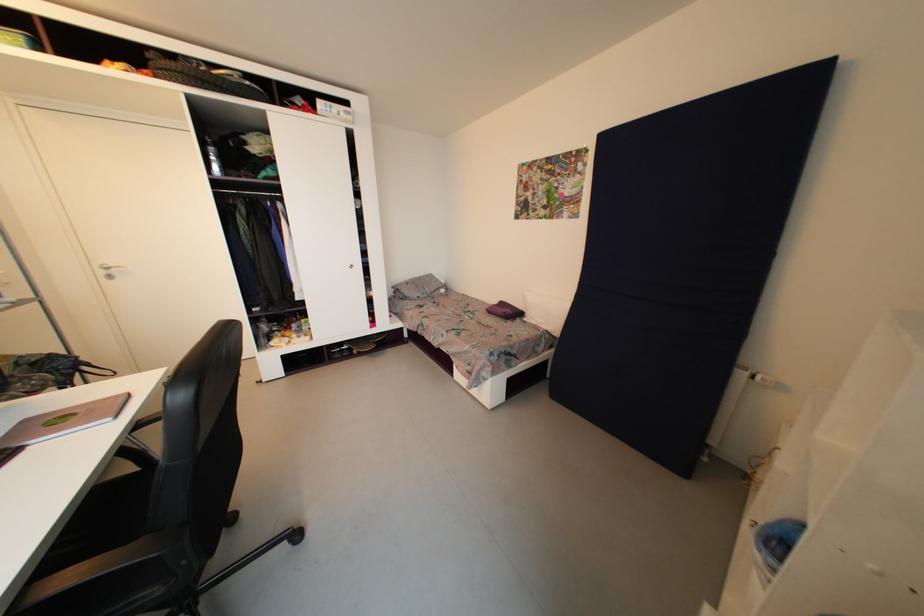
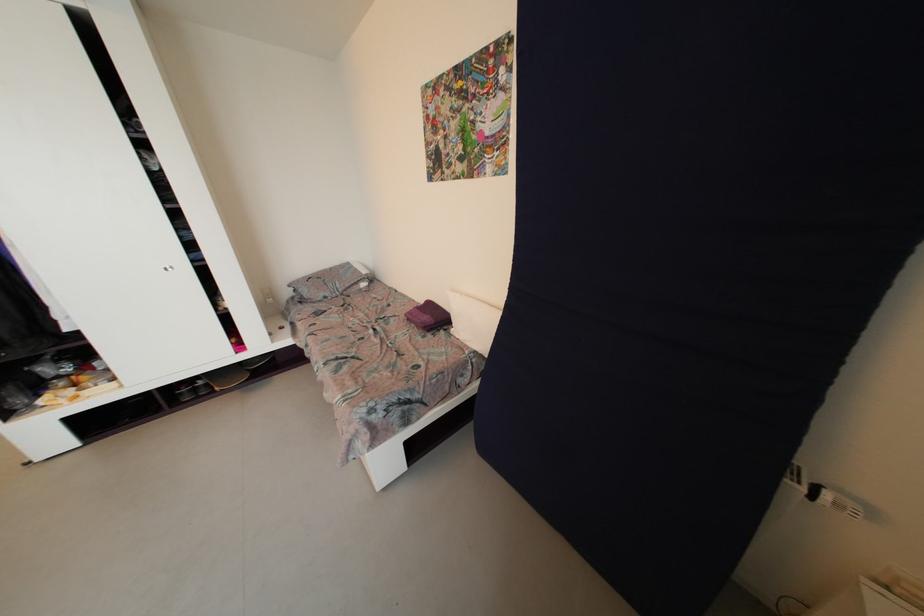
Find the pixel in the second image that matches point (397, 290) in the first image.

(294, 288)